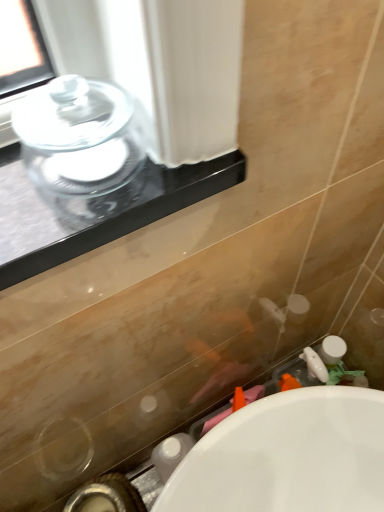
What do you see at coordinates (81, 149) in the screenshot? This screenshot has width=384, height=512. I see `transparent glass jar at upper left` at bounding box center [81, 149].

Where is `transparent glass jar at upper left`? This screenshot has width=384, height=512. transparent glass jar at upper left is located at coordinates (81, 149).

Identify the location of transparent glass jar at upper left. Image resolution: width=384 pixels, height=512 pixels. (81, 149).